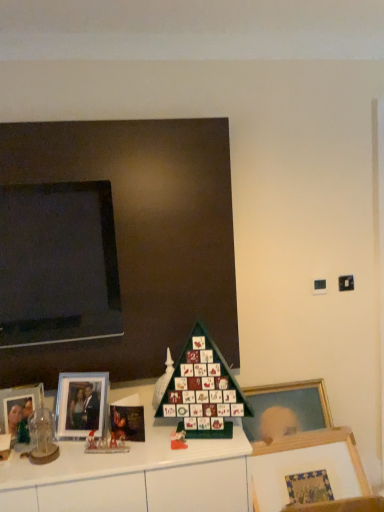
Question: Can you confirm if wooden picture frame at lower right, placed as the first picture frame when sorted from right to left, is wider than matte black board at upper left?

Choices:
 (A) yes
 (B) no

Answer: (A)

Question: From a real-world perspective, is wooden picture frame at lower right, arranged as the 3th picture frame when viewed from the left, beneath matte black board at upper left?

Choices:
 (A) no
 (B) yes

Answer: (B)

Question: Considering the relative sizes of wooden picture frame at lower right, arranged as the 3th picture frame when viewed from the left, and matte black board at upper left in the image provided, is wooden picture frame at lower right, arranged as the 3th picture frame when viewed from the left, thinner than matte black board at upper left?

Choices:
 (A) yes
 (B) no

Answer: (B)

Question: Is wooden picture frame at lower right, arranged as the 3th picture frame when viewed from the left, placed right next to matte black board at upper left?

Choices:
 (A) yes
 (B) no

Answer: (B)

Question: Is wooden picture frame at lower right, placed as the first picture frame when sorted from right to left, further to camera compared to matte black board at upper left?

Choices:
 (A) yes
 (B) no

Answer: (B)

Question: Is wooden picture frame at lower right, arranged as the 3th picture frame when viewed from the left, looking in the opposite direction of matte black board at upper left?

Choices:
 (A) yes
 (B) no

Answer: (B)

Question: From the image's perspective, is matte plastic advent calendar at center, which ranks as the 1th toy in right-to-left order, located beneath wooden picture frame at lower right, placed as the first picture frame when sorted from right to left?

Choices:
 (A) no
 (B) yes

Answer: (A)

Question: Does matte plastic advent calendar at center, the second toy viewed from the back, have a greater height compared to wooden picture frame at lower right, placed as the first picture frame when sorted from right to left?

Choices:
 (A) no
 (B) yes

Answer: (A)

Question: Is matte plastic advent calendar at center, the 2th toy positioned from the front, far from wooden picture frame at lower right, placed as the first picture frame when sorted from right to left?

Choices:
 (A) no
 (B) yes

Answer: (A)

Question: Is matte plastic advent calendar at center, the second toy viewed from the back, oriented towards wooden picture frame at lower right, placed as the first picture frame when sorted from right to left?

Choices:
 (A) no
 (B) yes

Answer: (A)

Question: Considering the relative sizes of matte plastic advent calendar at center, the second toy viewed from the back, and wooden picture frame at lower right, arranged as the 3th picture frame when viewed from the left, in the image provided, is matte plastic advent calendar at center, the second toy viewed from the back, wider than wooden picture frame at lower right, arranged as the 3th picture frame when viewed from the left,?

Choices:
 (A) no
 (B) yes

Answer: (A)

Question: From a real-world perspective, is matte plastic advent calendar at center, the 3th toy when ordered from left to right, located higher than wooden picture frame at lower right, placed as the first picture frame when sorted from right to left?

Choices:
 (A) no
 (B) yes

Answer: (B)

Question: Is the position of matte glass picture frame at left, which appears as the second picture frame when viewed from the right, more distant than that of matte black board at upper left?

Choices:
 (A) yes
 (B) no

Answer: (B)